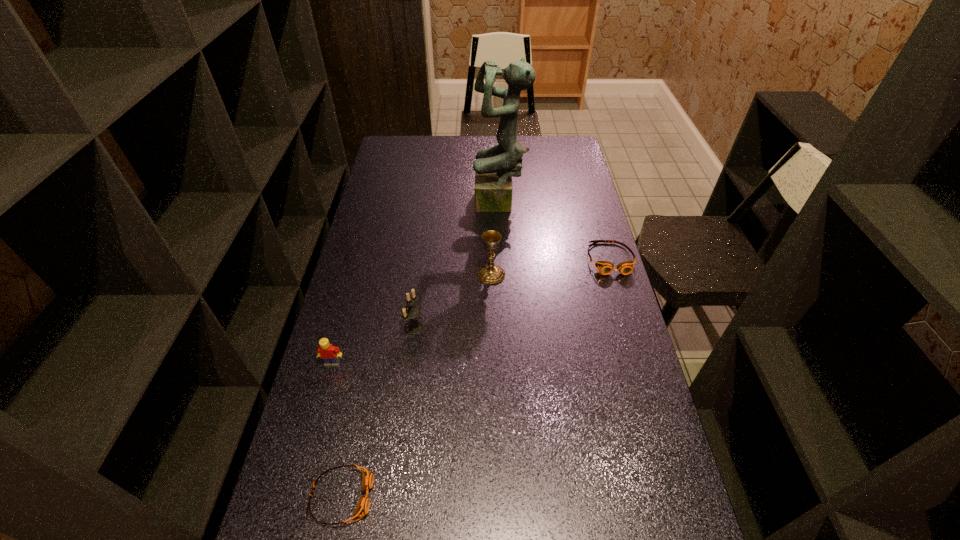
Please mark a free spot for a new goggles to balance the arrangement. Please provide its 2D coordinates. Your answer should be formatted as a tuple, i.e. [(x, y)], where the tuple contains the x and y coordinates of a point satisfying the conditions above.

[(504, 353)]